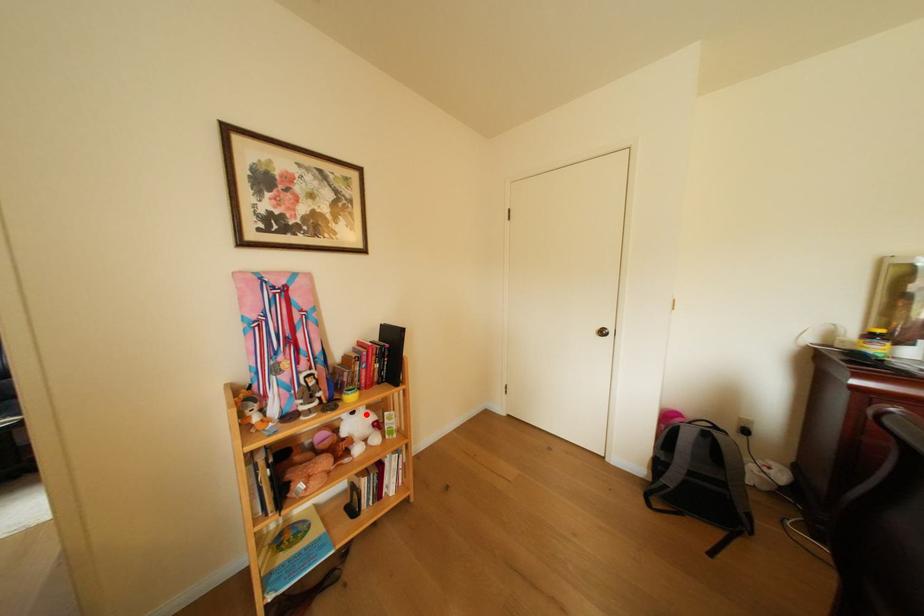
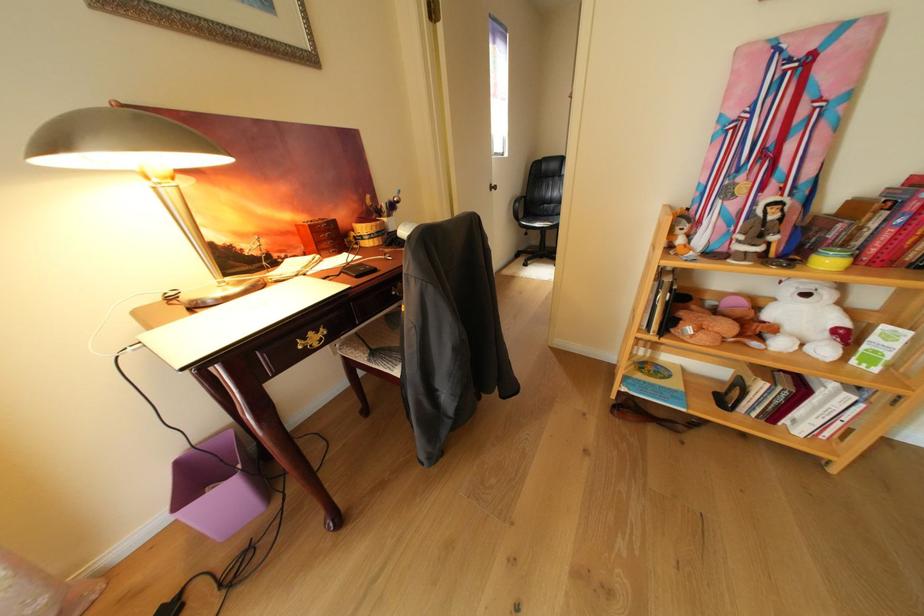
Question: I am providing you with two images of the same scene from different viewpoints. In image1, a red point is highlighted. Considering the same 3D point in image2, which of the following is correct?

Choices:
 (A) It is closer
 (B) It is farther

Answer: (A)